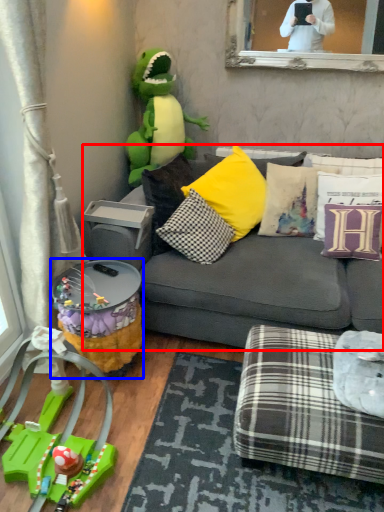
Question: Among these objects, which one is farthest to the camera, studio couch (highlighted by a red box) or side table (highlighted by a blue box)?

Choices:
 (A) studio couch
 (B) side table

Answer: (B)